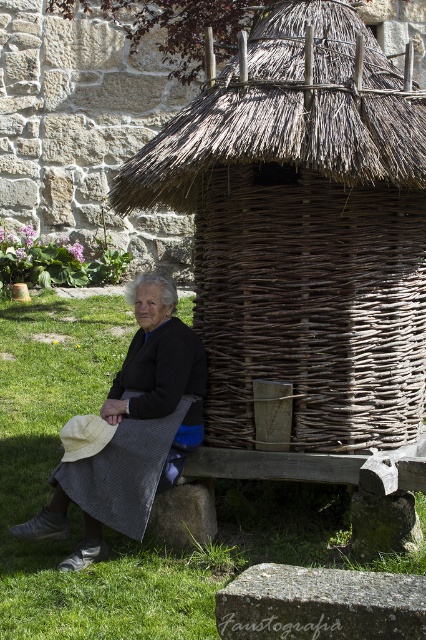
Consider the image. Can you confirm if brown woven hut at center is positioned below green grass at lower left?

Incorrect, brown woven hut at center is not positioned below green grass at lower left.

Can you confirm if brown woven hut at center is positioned to the right of green grass at lower left?

Correct, you'll find brown woven hut at center to the right of green grass at lower left.

Describe the element at coordinates (302, 230) in the screenshot. The image size is (426, 640). I see `brown woven hut at center` at that location.

Identify the location of brown woven hut at center. (302, 230).

Between woven brown basket at center and matte black skirt at lower left, which one is positioned higher?

woven brown basket at center is above.

Can you confirm if woven brown basket at center is positioned to the left of matte black skirt at lower left?

In fact, woven brown basket at center is to the right of matte black skirt at lower left.

Who is more forward, (212, 248) or (143, 413)?

Positioned in front is point (143, 413).

This screenshot has width=426, height=640. I want to click on woven brown basket at center, so click(310, 305).

Between brown woven hut at center and matte black skirt at lower left, which one appears on the left side from the viewer's perspective?

matte black skirt at lower left

Is point (259, 228) closer to viewer compared to point (140, 451)?

That is False.

Where is `brown woven hut at center`? Image resolution: width=426 pixels, height=640 pixels. brown woven hut at center is located at coordinates (302, 230).